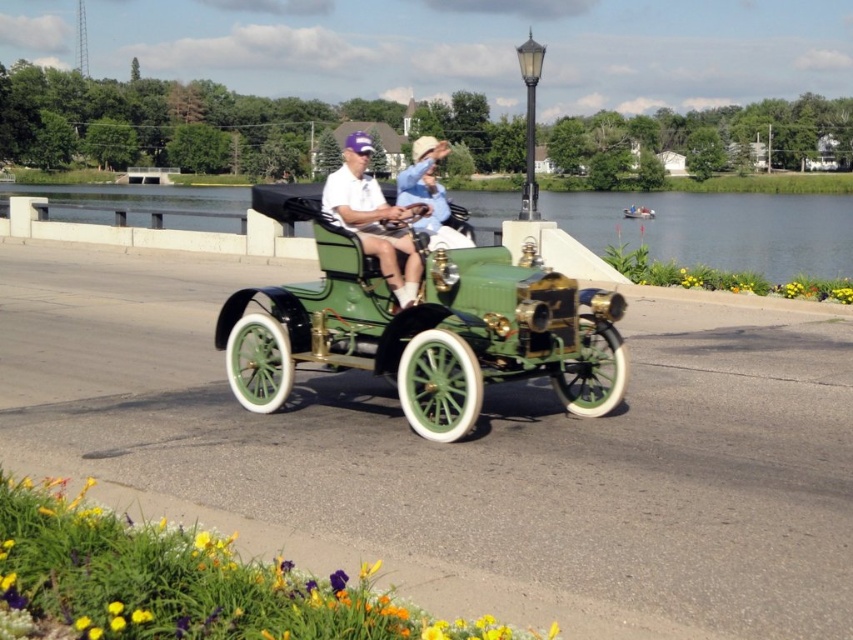
Can you confirm if green polished wood water at center is positioned to the right of matte green hat at center?

Incorrect, green polished wood water at center is not on the right side of matte green hat at center.

How much distance is there between green polished wood water at center and matte green hat at center?

93.86 feet

Does point (546, 196) come behind point (397, 179)?

Yes.

Where is `green polished wood water at center`? This screenshot has height=640, width=853. green polished wood water at center is located at coordinates (718, 228).

Who is lower down, green matte vintage car at center or matte green hat at center?

green matte vintage car at center

The width and height of the screenshot is (853, 640). Identify the location of green matte vintage car at center. (422, 326).

Is green matte vintage car at center below green polished wood water at center?

Yes.

Between green matte vintage car at center and green polished wood water at center, which one is positioned higher?

Positioned higher is green polished wood water at center.

Identify the location of green matte vintage car at center. (422, 326).